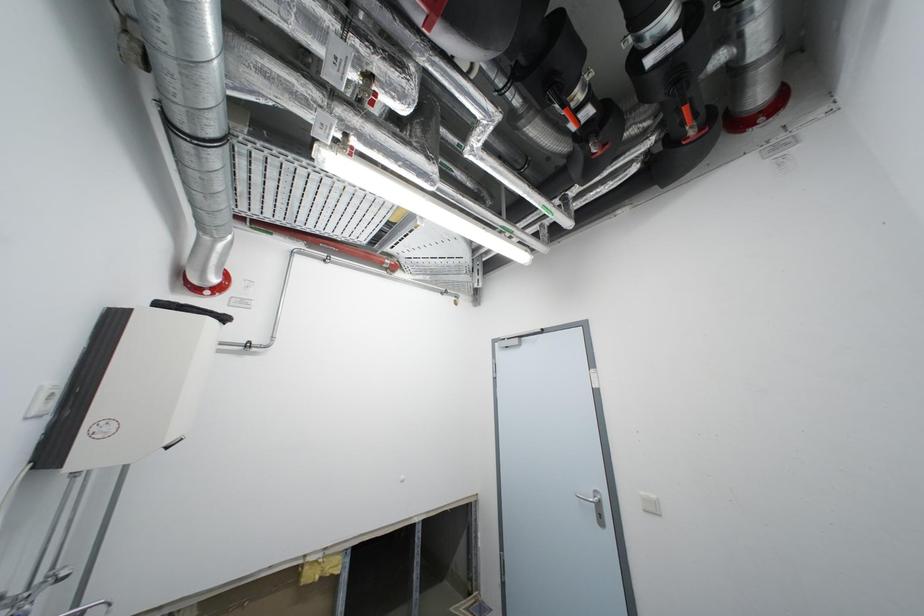
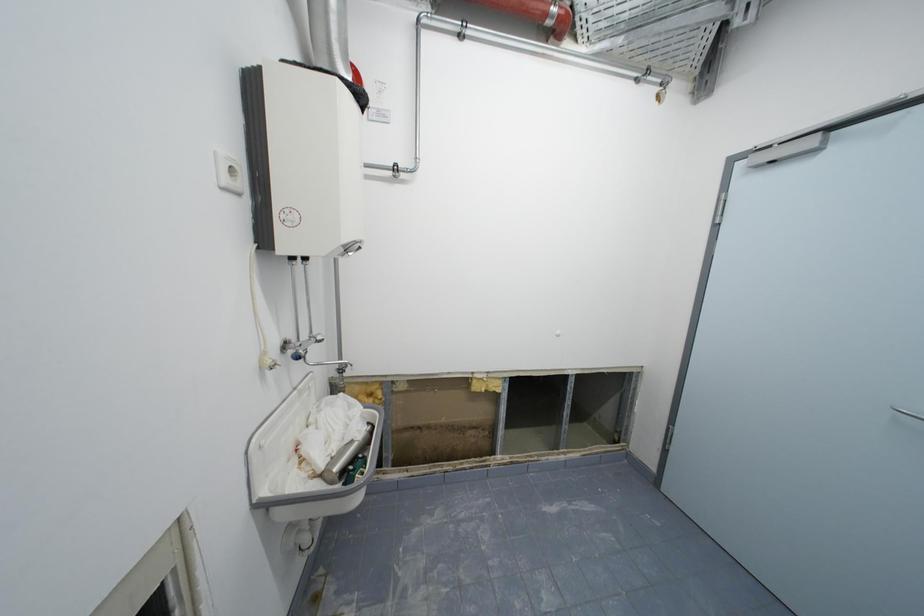
First-person continuous shooting, in which direction is the camera rotating?

The rotation direction of the camera is left-down.